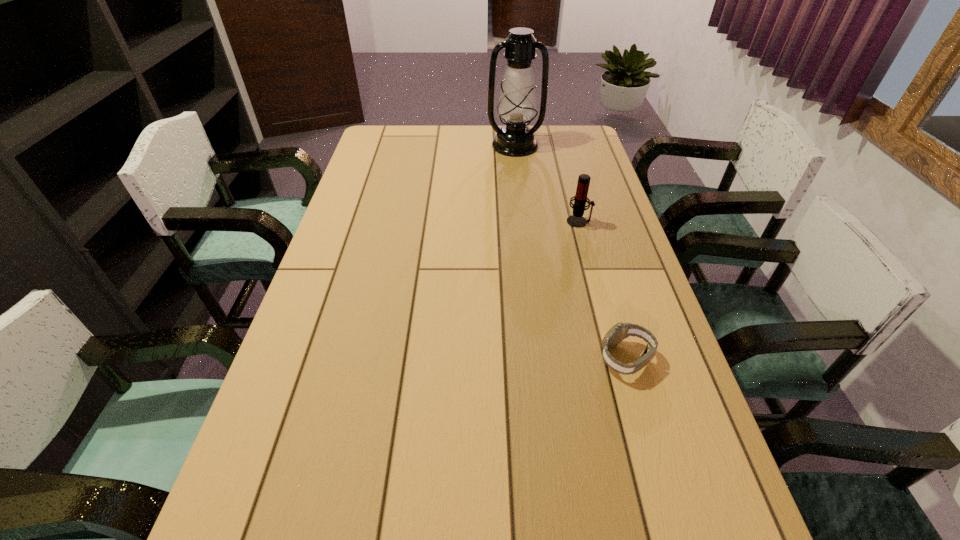
Where is `the leftmost object`? The width and height of the screenshot is (960, 540). the leftmost object is located at coordinates (517, 104).

Find the location of a particular element. The image size is (960, 540). the tallest object is located at coordinates (517, 104).

Locate an element on the screen. The image size is (960, 540). microphone is located at coordinates (576, 220).

The height and width of the screenshot is (540, 960). Identify the location of the second nearest object. (576, 220).

Image resolution: width=960 pixels, height=540 pixels. I want to click on the shortest object, so tap(620, 331).

Find the location of a particular element. The height and width of the screenshot is (540, 960). the nearest object is located at coordinates (620, 331).

At what (x,y) coordinates should I click in order to perform the action: click on vacant space located 0.140m on the right of the leftmost object. Please return your answer as a coordinate pair (x, y). This screenshot has width=960, height=540. Looking at the image, I should click on (579, 146).

This screenshot has height=540, width=960. Find the location of `blank space located on the back of the microphone`. blank space located on the back of the microphone is located at coordinates (566, 175).

Where is `vacant space situated 0.050m on the face of the watch`? vacant space situated 0.050m on the face of the watch is located at coordinates (578, 358).

Identify the location of blank area located 0.250m on the face of the watch. (489, 358).